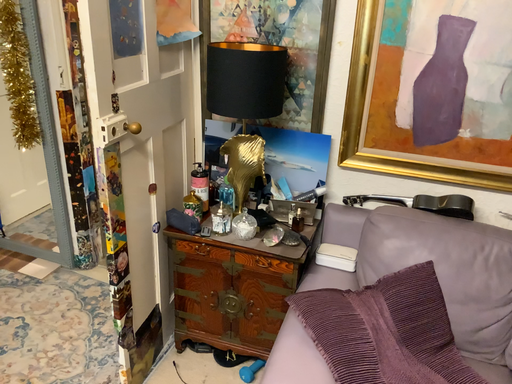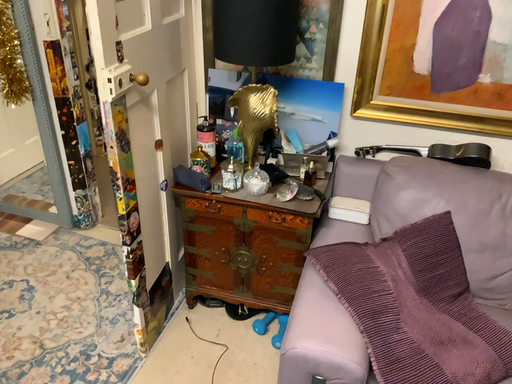
Question: How did the camera likely rotate when shooting the video?

Choices:
 (A) rotated downward
 (B) rotated upward

Answer: (A)